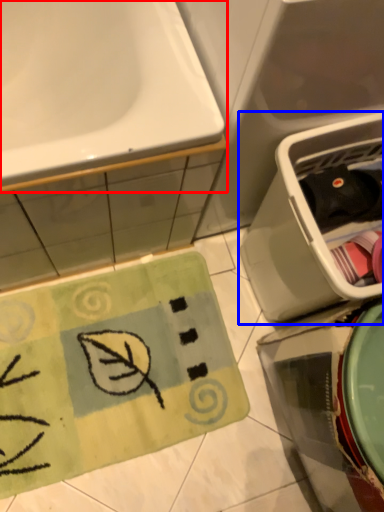
Question: Which point is closer to the camera, sink (highlighted by a red box) or dish washer (highlighted by a blue box)?

Choices:
 (A) sink
 (B) dish washer

Answer: (A)